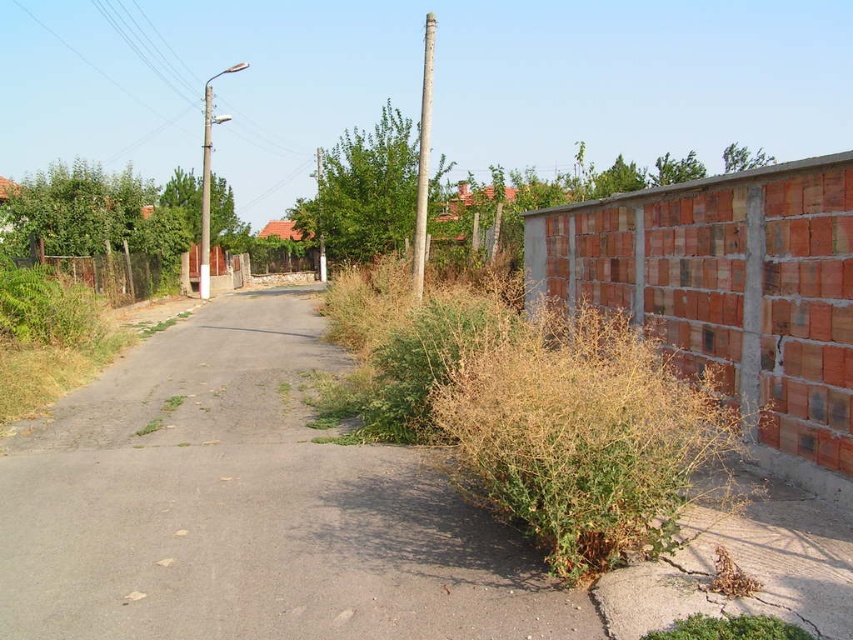
You are a gardener who needs to plant a new tree in the garden. You have a small sapling that requires a planting area of 2 square meters. Based on the scene, can the gray asphalt driveway at center provide enough space for the sapling compared to the green leafy tree at center?

The gray asphalt driveway at center is smaller than the green leafy tree at center. Since the driveway is smaller, it may not provide sufficient space for the sapling requiring 2 square meters. Consider using the area near the green leafy tree at center instead.

You are a delivery driver approaching the gray asphalt driveway at center and the green leafy tree at center. Which object will you encounter first as you drive forward?

The gray asphalt driveway at center is in front of the green leafy tree at center, so you will encounter the gray asphalt driveway at center first.